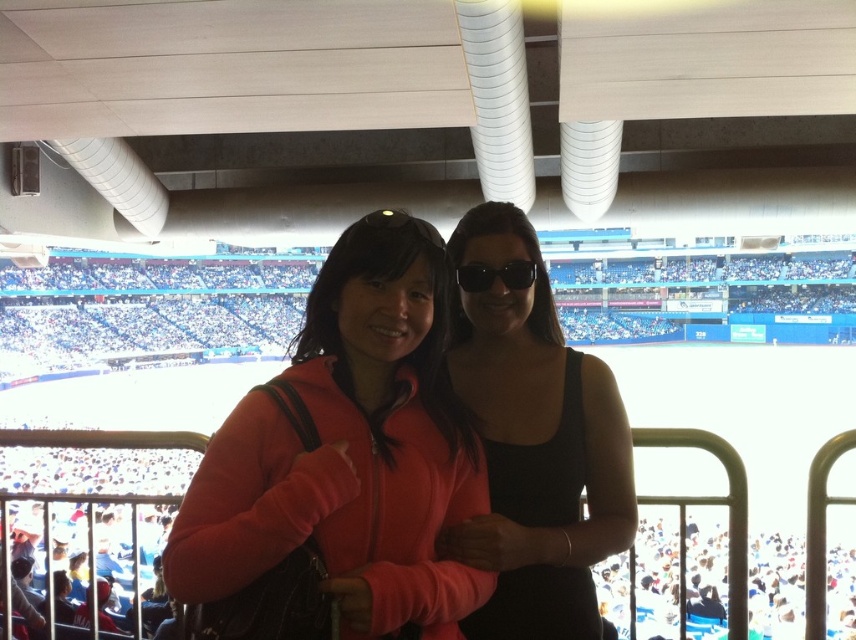
Which is in front, point (306, 406) or point (500, 612)?

Point (306, 406) is more forward.

Who is more distant from viewer, (x=367, y=365) or (x=627, y=536)?

The point (x=627, y=536) is more distant.

Between point (227, 541) and point (522, 445), which one is positioned behind?

Point (522, 445)

In order to click on matte orange jacket at center in this screenshot , I will do `click(349, 451)`.